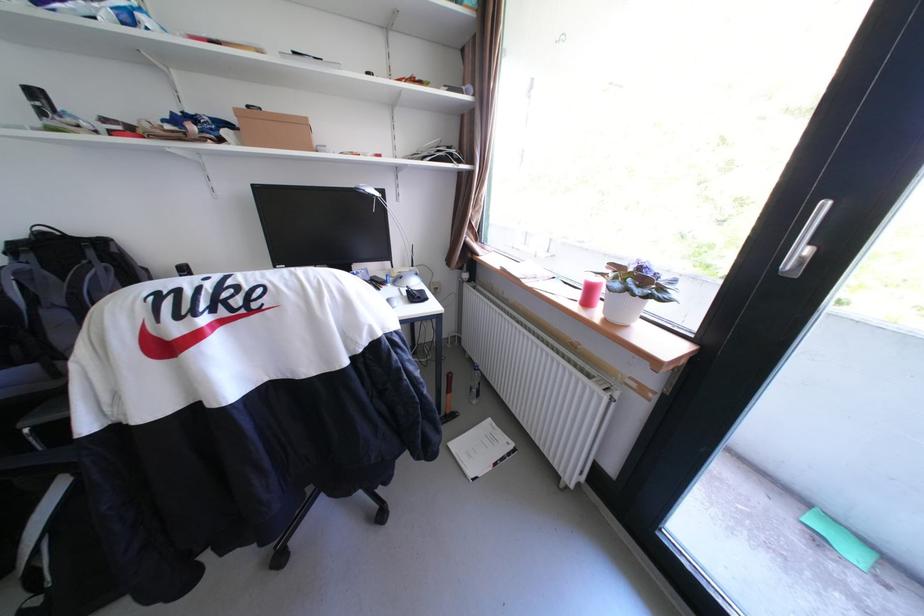
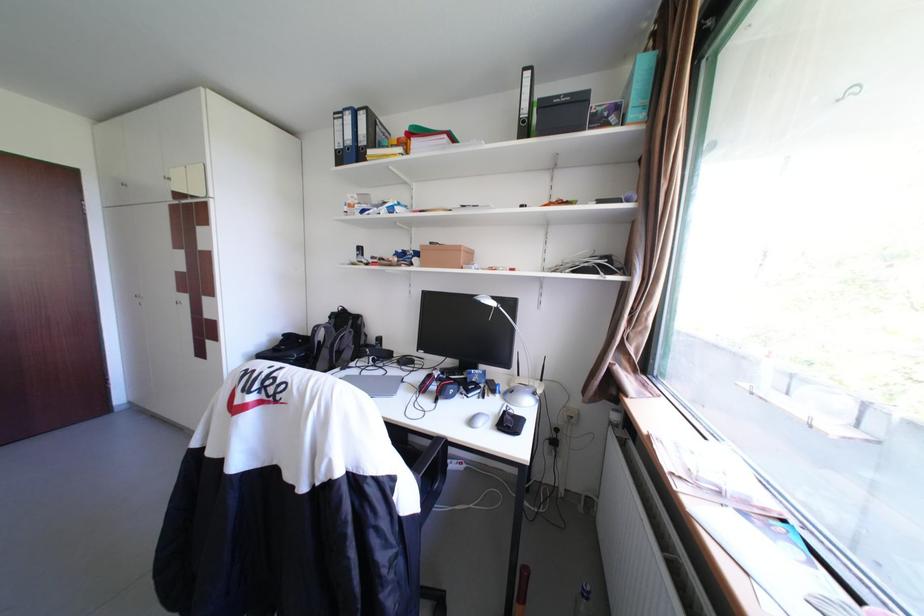
Question: The first image is from the beginning of the video and the second image is from the end. How did the camera likely rotate when shooting the video?

Choices:
 (A) Left
 (B) Right
 (C) Up
 (D) Down

Answer: (A)